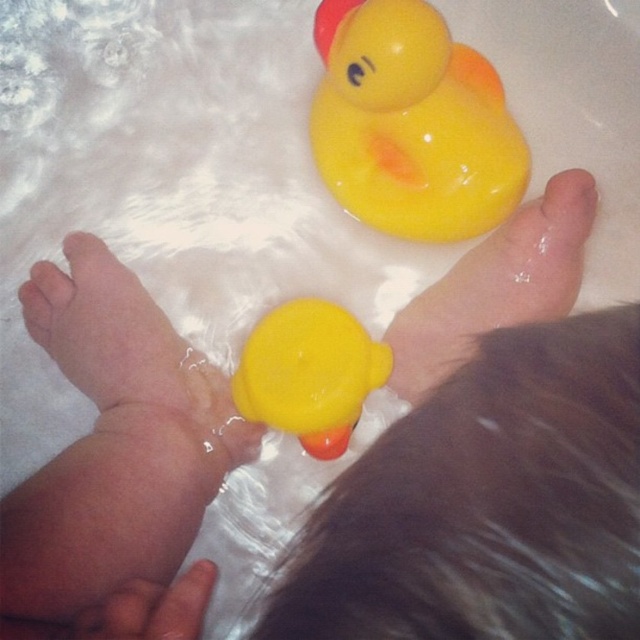
Question: Which of the following is the closest to the observer?

Choices:
 (A) smooth skin hand at lower left
 (B) matte rubber duck at upper center

Answer: (B)

Question: Does matte rubber duck at upper center appear on the right side of rubber duck at upper center?

Choices:
 (A) yes
 (B) no

Answer: (B)

Question: Which point is closer to the camera?

Choices:
 (A) (186, 600)
 (B) (554, 364)
 (C) (435, 310)
 (D) (275, 397)

Answer: (B)

Question: Which of the following is the farthest from the observer?

Choices:
 (A) matte yellow rubber duck at center
 (B) smooth skin hand at lower left
 (C) rubber duck at upper center
 (D) matte yellow rubber duck at lower center

Answer: (C)

Question: Considering the relative positions of matte yellow rubber duck at lower center and smooth skin hand at lower left in the image provided, where is matte yellow rubber duck at lower center located with respect to smooth skin hand at lower left?

Choices:
 (A) below
 (B) above

Answer: (B)

Question: Does matte yellow rubber duck at lower center come behind matte rubber foot at center?

Choices:
 (A) yes
 (B) no

Answer: (B)